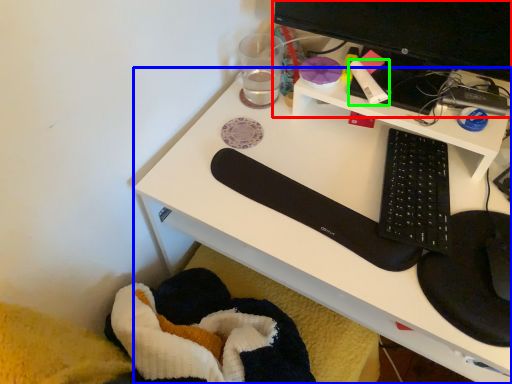
Question: Which is farther away from desktop computer (highlighted by a red box)? desk (highlighted by a blue box) or stationery (highlighted by a green box)?

Choices:
 (A) desk
 (B) stationery

Answer: (A)